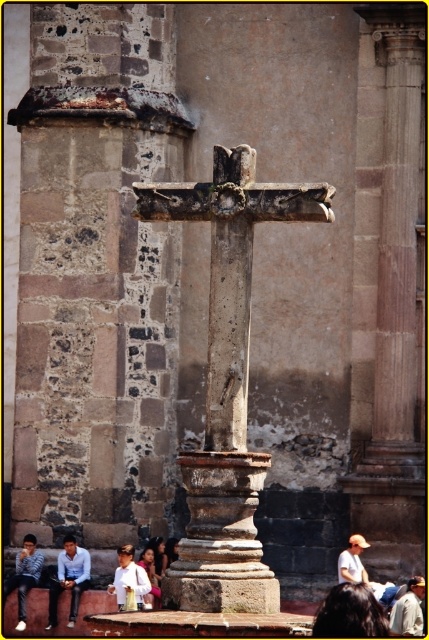
You are a photographer trying to capture both the blue striped shirt at lower left and the light brown leather hat at center in your frame. Which object should you focus on first if you want to ensure the larger object is in sharp focus?

The light brown leather hat at center is larger since it occupies more space than the blue striped shirt at lower left. Focus on the light brown leather hat at center first to ensure it is in sharp focus.

From the picture: You are standing in front of the historic stone building and see the light brown leather hat at center. Where would you look to find the hat?

The light brown leather hat at center is located at the central area of the scene, so you should look towards the middle of the image to find it.